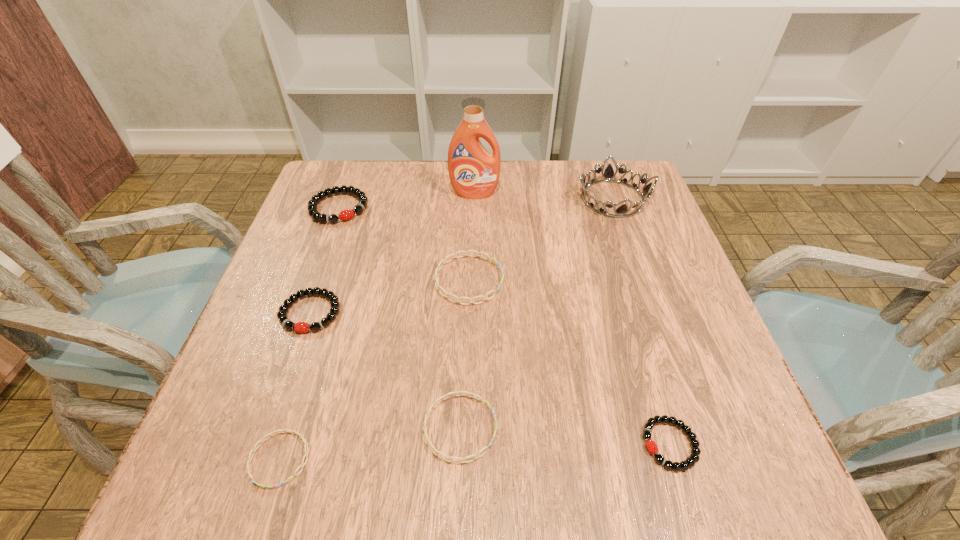
Image resolution: width=960 pixels, height=540 pixels. Find the location of `black bracelet that stands as the third closest to the second biggest blue bracelet`. black bracelet that stands as the third closest to the second biggest blue bracelet is located at coordinates (348, 214).

Where is `blue bracelet object that ranks as the second closest to the farthest blue bracelet`? blue bracelet object that ranks as the second closest to the farthest blue bracelet is located at coordinates (301, 436).

Locate which blue bracelet ranks third in proximity to the detergent. Please provide its 2D coordinates. Your answer should be formatted as a tuple, i.e. [(x, y)], where the tuple contains the x and y coordinates of a point satisfying the conditions above.

[(301, 436)]

The height and width of the screenshot is (540, 960). I want to click on free location that satisfies the following two spatial constraints: 1. on the surface of the biggest blue bracelet showing star-shaped elements; 2. on the back side of the smallest black bracelet, so click(x=465, y=444).

The image size is (960, 540). Identify the location of free space that satisfies the following two spatial constraints: 1. on the back side of the rightmost black bracelet; 2. on the surface of the farthest blue bracelet showing star-shaped elements. (620, 280).

Locate an element on the screen. The width and height of the screenshot is (960, 540). vacant space that satisfies the following two spatial constraints: 1. on the front side of the second nearest black bracelet; 2. on the right side of the rightmost bracelet is located at coordinates (266, 444).

At what (x,y) coordinates should I click in order to perform the action: click on vacant region that satisfies the following two spatial constraints: 1. on the surface of the farthest blue bracelet showing star-shaped elements; 2. on the surface of the shortest bracelet showing star-shaped elements. Please return your answer as a coordinate pair (x, y). Image resolution: width=960 pixels, height=540 pixels. Looking at the image, I should click on (465, 459).